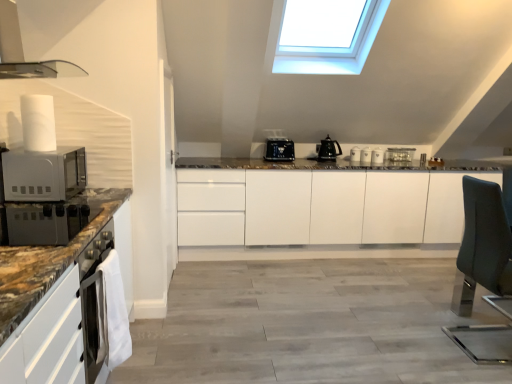
Question: Visually, is white matte microwave oven at left positioned to the left or to the right of satin silver toaster at center, which is the 1th appliance in right-to-left order?

Choices:
 (A) right
 (B) left

Answer: (B)

Question: In the image, is white matte microwave oven at left positioned in front of or behind satin silver toaster at center, the 1th appliance positioned from the back?

Choices:
 (A) behind
 (B) front

Answer: (B)

Question: Based on their relative distances, which object is nearer to the white glossy mugs at center, which appears as the 2th appliance when viewed from the front?

Choices:
 (A) black glossy kettle at center, the 1th kitchen appliance positioned from the right
 (B) black plastic toaster at center, positioned as the 1th kitchen appliance in left-to-right order
 (C) satin silver toaster at center, which is the 1th appliance in right-to-left order
 (D) white glossy mug at upper center, the 2th appliance positioned from the back
 (E) teal fabric swivel chair at right

Answer: (D)

Question: Which object is the farthest from the white glossy mugs at center, the 4th appliance viewed from the back?

Choices:
 (A) black plastic toaster at center, which appears as the 2th kitchen appliance when viewed from the right
 (B) satin silver toaster at center, which appears as the fifth appliance when viewed from the left
 (C) white glossy coffee cup at center, which is the third appliance from back to front
 (D) black glossy kettle at center, the 1th kitchen appliance positioned from the right
 (E) teal fabric swivel chair at right

Answer: (E)